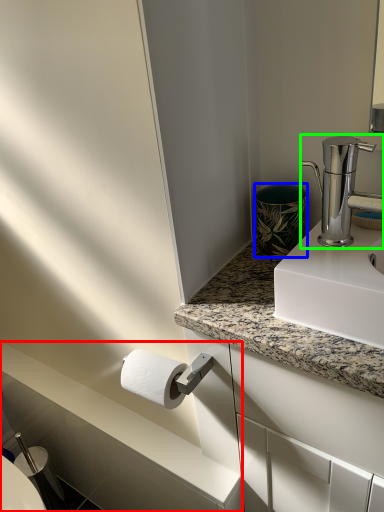
Question: Estimate the real-world distances between objects in this image. Which object is farther from counter top (highlighted by a red box), appliance (highlighted by a blue box) or tap (highlighted by a green box)?

Choices:
 (A) appliance
 (B) tap

Answer: (B)